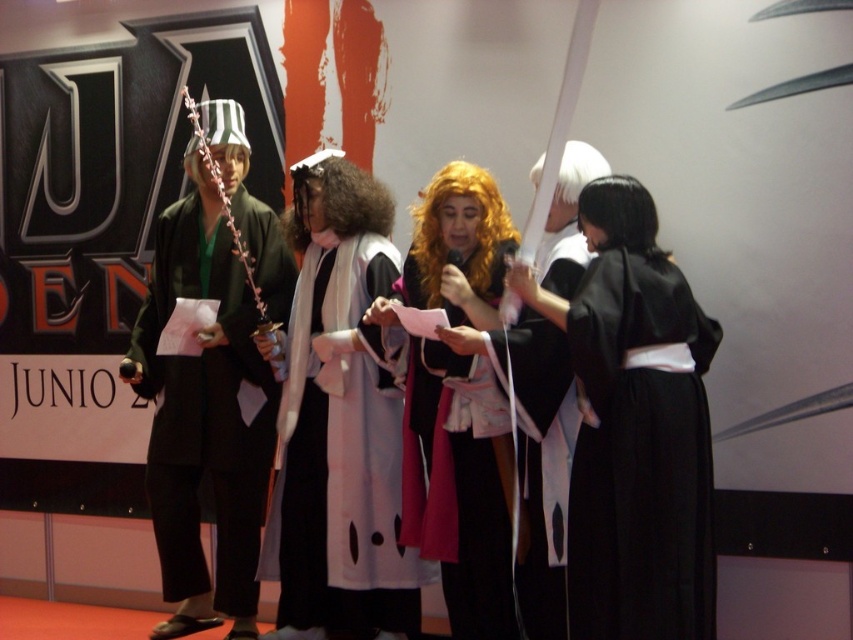
Question: Can you confirm if matte black kimono at center is thinner than shiny orange wig at center?

Choices:
 (A) yes
 (B) no

Answer: (B)

Question: Which point is closer to the camera?

Choices:
 (A) (438, 294)
 (B) (602, 195)

Answer: (B)

Question: Is black silk kimono at right positioned before white matte kimono at center?

Choices:
 (A) yes
 (B) no

Answer: (A)

Question: Which is farther from the shiny orange wig at center?

Choices:
 (A) matte black kimono at center
 (B) black silky wig at right

Answer: (B)

Question: Does black silk kimono at right have a lesser width compared to matte black kimono at center?

Choices:
 (A) yes
 (B) no

Answer: (B)

Question: Which object is farther from the camera taking this photo?

Choices:
 (A) shiny orange wig at center
 (B) black silk kimono at right

Answer: (A)